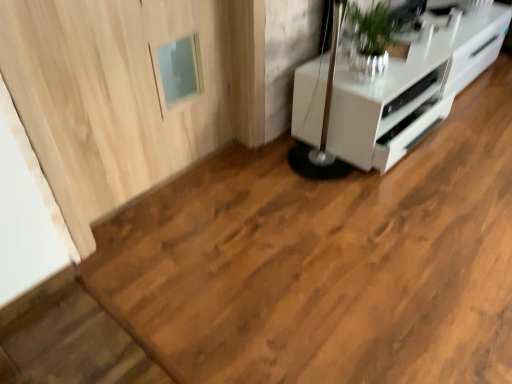
Image resolution: width=512 pixels, height=384 pixels. What are the coordinates of `green leafy plant at upper right` in the screenshot? It's located at (371, 40).

What do you see at coordinates (114, 95) in the screenshot? The image size is (512, 384). I see `light wood door at upper left` at bounding box center [114, 95].

The width and height of the screenshot is (512, 384). Describe the element at coordinates (410, 94) in the screenshot. I see `white glossy appliance at upper right` at that location.

The width and height of the screenshot is (512, 384). I want to click on white glossy cabinet at upper right, so click(411, 89).

Image resolution: width=512 pixels, height=384 pixels. In order to click on green leafy plant at upper right in this screenshot , I will do `click(371, 40)`.

Considering the sizes of objects white glossy cabinet at upper right and green leafy plant at upper right in the image provided, who is wider, white glossy cabinet at upper right or green leafy plant at upper right?

white glossy cabinet at upper right.

Locate an element on the screen. houseplant above the white glossy cabinet at upper right (from a real-world perspective) is located at coordinates (x=371, y=40).

Which is correct: white glossy cabinet at upper right is inside green leafy plant at upper right, or outside of it?

The correct answer is: outside.

Which is correct: green leafy plant at upper right is inside light wood door at upper left, or outside of it?

green leafy plant at upper right lies outside light wood door at upper left.

In the scene shown: Is light wood door at upper left at the back of green leafy plant at upper right?

green leafy plant at upper right does not have its back to light wood door at upper left.

How far apart are green leafy plant at upper right and light wood door at upper left?

They are 30.62 inches apart.

Can you tell me how much green leafy plant at upper right and light wood door at upper left differ in facing direction?

green leafy plant at upper right and light wood door at upper left are facing 0.00142 degrees away from each other.

From the image's perspective, is light wood door at upper left positioned above or below white glossy cabinet at upper right?

Clearly, from the image's perspective, light wood door at upper left is below white glossy cabinet at upper right.

Looking at the image, does light wood door at upper left seem bigger or smaller compared to white glossy cabinet at upper right?

light wood door at upper left is smaller than white glossy cabinet at upper right.

Consider the image. Between light wood door at upper left and white glossy cabinet at upper right, which one has more height?

light wood door at upper left.

Locate an element on the screen. Image resolution: width=512 pixels, height=384 pixels. furniture to the right of light wood door at upper left is located at coordinates (411, 89).

How different are the orientations of green leafy plant at upper right and white glossy cabinet at upper right in degrees?

The angular difference between green leafy plant at upper right and white glossy cabinet at upper right is 0.346 degrees.

From their relative heights in the image, would you say green leafy plant at upper right is taller or shorter than white glossy cabinet at upper right?

In the image, green leafy plant at upper right appears to be taller than white glossy cabinet at upper right.

Considering the points (361, 26) and (472, 65), which point is in front, point (361, 26) or point (472, 65)?

Point (361, 26)

How many degrees apart are the facing directions of white glossy appliance at upper right and green leafy plant at upper right?

0.000772 degrees separate the facing orientations of white glossy appliance at upper right and green leafy plant at upper right.

From the image's perspective, would you say white glossy appliance at upper right is positioned over green leafy plant at upper right?

No, from the image's perspective, white glossy appliance at upper right is not over green leafy plant at upper right.

Would you consider white glossy appliance at upper right to be distant from green leafy plant at upper right?

white glossy appliance at upper right is near green leafy plant at upper right, not far away.

From the picture: Is light wood door at upper left at the back of white glossy appliance at upper right?

No, white glossy appliance at upper right is not facing away from light wood door at upper left.

Between white glossy appliance at upper right and light wood door at upper left, which one has smaller width?

light wood door at upper left.

Considering the sizes of white glossy appliance at upper right and light wood door at upper left in the image, is white glossy appliance at upper right taller or shorter than light wood door at upper left?

Clearly, white glossy appliance at upper right is shorter compared to light wood door at upper left.

From a real-world perspective, is white glossy appliance at upper right on top of light wood door at upper left?

No.

Is point (222, 84) farther from camera compared to point (355, 38)?

Yes, it is behind point (355, 38).

In the image, is light wood door at upper left on the left side or the right side of green leafy plant at upper right?

light wood door at upper left is to the left of green leafy plant at upper right.

Where is `door beneath the green leafy plant at upper right (from a real-world perspective)`? door beneath the green leafy plant at upper right (from a real-world perspective) is located at coordinates (114, 95).

In terms of height, does light wood door at upper left look taller or shorter compared to green leafy plant at upper right?

light wood door at upper left is taller than green leafy plant at upper right.

Find the location of a particular element. This screenshot has height=384, width=512. furniture that is on the right side of green leafy plant at upper right is located at coordinates (411, 89).

The height and width of the screenshot is (384, 512). In order to click on houseplant located above the light wood door at upper left (from the image's perspective) in this screenshot , I will do `click(371, 40)`.

Considering their positions, is white glossy appliance at upper right positioned closer to white glossy cabinet at upper right than light wood door at upper left?

Based on the image, white glossy appliance at upper right appears to be nearer to white glossy cabinet at upper right.

Looking at the image, which one is located further to light wood door at upper left, white glossy appliance at upper right or white glossy cabinet at upper right?

white glossy appliance at upper right.

When comparing their distances from white glossy cabinet at upper right, does light wood door at upper left or green leafy plant at upper right seem further?

The object further to white glossy cabinet at upper right is light wood door at upper left.

Looking at the image, which one is located closer to light wood door at upper left, white glossy appliance at upper right or green leafy plant at upper right?

The object closer to light wood door at upper left is green leafy plant at upper right.

From the image, which object appears to be nearer to green leafy plant at upper right, white glossy appliance at upper right or light wood door at upper left?

Among the two, white glossy appliance at upper right is located nearer to green leafy plant at upper right.

Which object lies further to the anchor point white glossy appliance at upper right, light wood door at upper left or white glossy cabinet at upper right?

light wood door at upper left.

From the image, which object appears to be farther from light wood door at upper left, green leafy plant at upper right or white glossy appliance at upper right?

Among the two, white glossy appliance at upper right is located further to light wood door at upper left.

Based on their spatial positions, is light wood door at upper left or white glossy appliance at upper right closer to white glossy cabinet at upper right?

Among the two, white glossy appliance at upper right is located nearer to white glossy cabinet at upper right.

This screenshot has width=512, height=384. What are the coordinates of `houseplant between light wood door at upper left and white glossy appliance at upper right in the horizontal direction` in the screenshot? It's located at (371, 40).

Image resolution: width=512 pixels, height=384 pixels. I want to click on houseplant between light wood door at upper left and white glossy cabinet at upper right from left to right, so click(x=371, y=40).

Where is `appliance between light wood door at upper left and white glossy cabinet at upper right from left to right`? appliance between light wood door at upper left and white glossy cabinet at upper right from left to right is located at coordinates (410, 94).

The width and height of the screenshot is (512, 384). In order to click on appliance between green leafy plant at upper right and white glossy cabinet at upper right from left to right in this screenshot , I will do `click(410, 94)`.